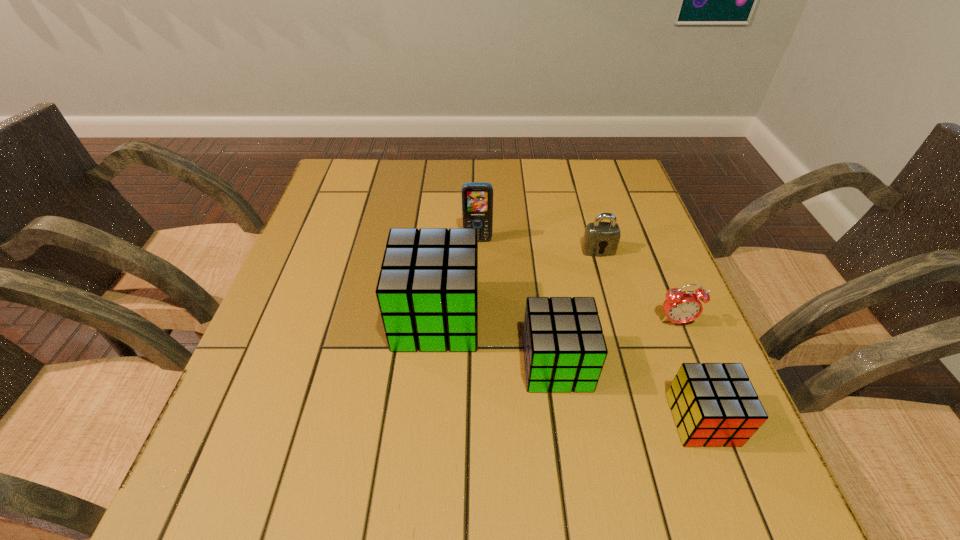
At what (x,y) coordinates should I click in order to perform the action: click on vacant space at the far edge. Please return your answer as a coordinate pair (x, y). Looking at the image, I should click on (540, 195).

Where is `vacant space at the near edge of the desktop`? vacant space at the near edge of the desktop is located at coordinates (436, 440).

In the image, there is a desktop. At what (x,y) coordinates should I click in order to perform the action: click on vacant space at the left edge. Please return your answer as a coordinate pair (x, y). The image size is (960, 540). Looking at the image, I should click on (313, 336).

Identify the location of vacant space at the right edge of the desktop. This screenshot has height=540, width=960. (624, 254).

At what (x,y) coordinates should I click in order to perform the action: click on free space at the far left corner of the desktop. Please return your answer as a coordinate pair (x, y). This screenshot has height=540, width=960. Looking at the image, I should click on (357, 166).

Find the location of a particular element. vacant point at the near left corner is located at coordinates (225, 436).

Image resolution: width=960 pixels, height=540 pixels. Identify the location of vacant position at the far right corner of the desktop. (599, 193).

The height and width of the screenshot is (540, 960). I want to click on vacant region between the cellular telephone and the third object from right to left, so click(x=538, y=245).

The image size is (960, 540). What are the coordinates of `vacant space in between the farthest object and the third object from left to right` in the screenshot? It's located at (517, 302).

Locate an element on the screen. free point between the tallest cube and the second cube from right to left is located at coordinates (496, 341).